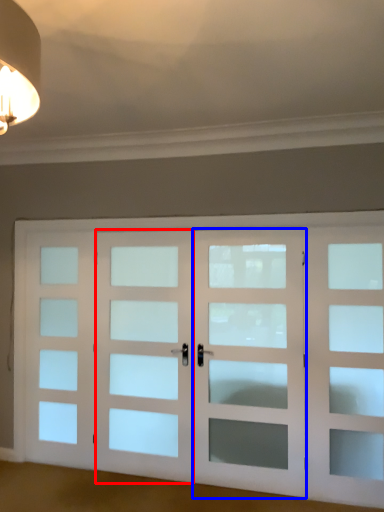
Question: Among these objects, which one is nearest to the camera, screen door (highlighted by a red box) or screen door (highlighted by a blue box)?

Choices:
 (A) screen door
 (B) screen door

Answer: (B)